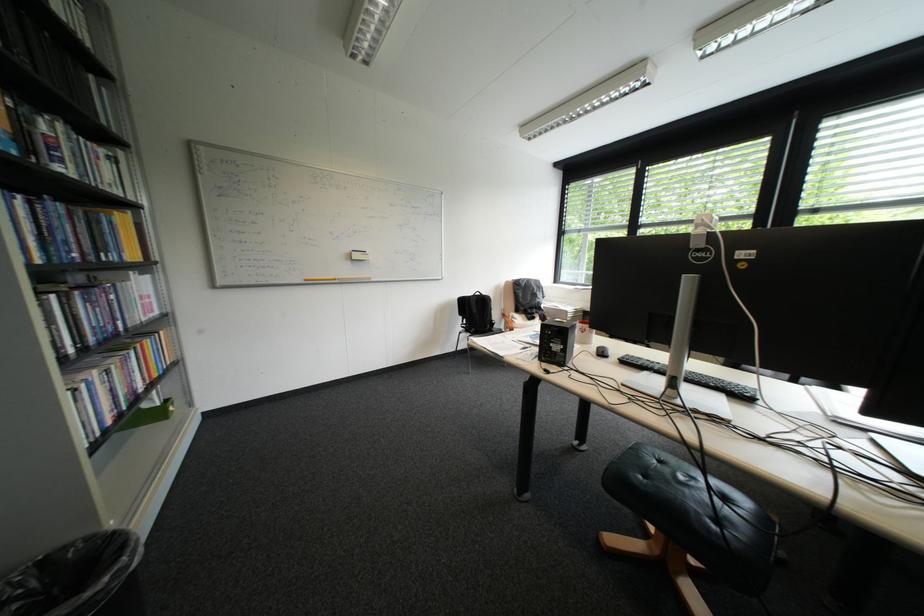
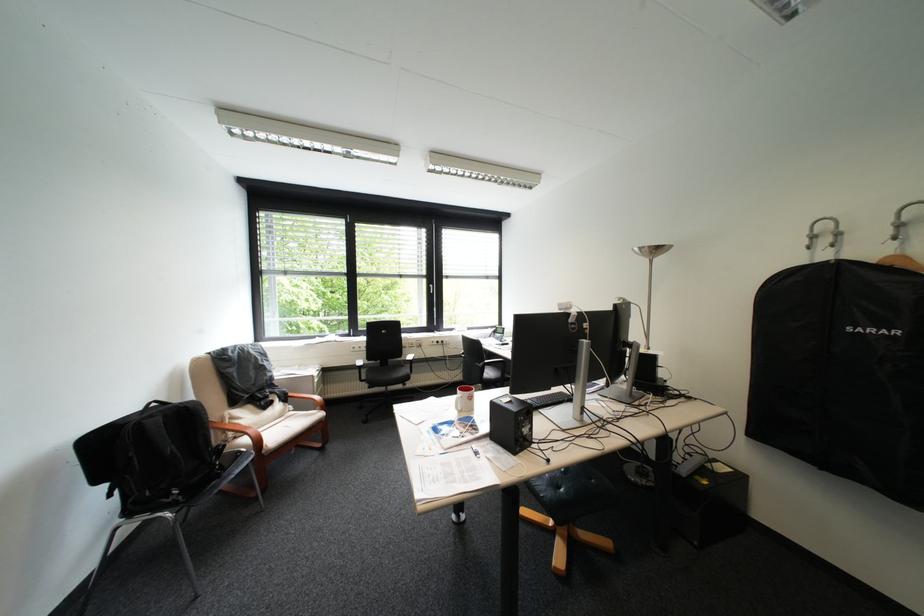
Question: I am providing you with two images of the same scene from different viewpoints. Please identify which objects are invisible in image2.

Choices:
 (A) red and white mug
 (B) wooden chair armrest
 (C) black backpack
 (D) none of these

Answer: (D)